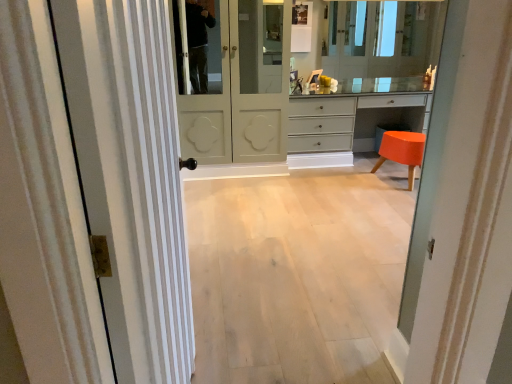
Question: Is clear glass mirror at upper center located outside light wood floor at center?

Choices:
 (A) yes
 (B) no

Answer: (A)

Question: From a real-world perspective, is clear glass mirror at upper center on light wood floor at center?

Choices:
 (A) no
 (B) yes

Answer: (B)

Question: Is light wood floor at center located within clear glass mirror at upper center?

Choices:
 (A) yes
 (B) no

Answer: (B)

Question: Is clear glass mirror at upper center at the left side of light wood floor at center?

Choices:
 (A) no
 (B) yes

Answer: (A)

Question: Does clear glass mirror at upper center have a greater height compared to light wood floor at center?

Choices:
 (A) no
 (B) yes

Answer: (B)

Question: Is clear glass mirror at upper center wider than light wood floor at center?

Choices:
 (A) yes
 (B) no

Answer: (B)

Question: Considering the relative sizes of matte gray chest of drawers at center and white striped door at left, the 1th door in the front-to-back sequence, in the image provided, is matte gray chest of drawers at center thinner than white striped door at left, the 1th door in the front-to-back sequence,?

Choices:
 (A) no
 (B) yes

Answer: (A)

Question: From a real-world perspective, is matte gray chest of drawers at center under white striped door at left, the 1th door in the front-to-back sequence?

Choices:
 (A) yes
 (B) no

Answer: (A)

Question: Is matte gray chest of drawers at center in front of white striped door at left, arranged as the 1th door when viewed from the left?

Choices:
 (A) no
 (B) yes

Answer: (A)

Question: Are matte gray chest of drawers at center and white striped door at left, which is the second door from back to front, making contact?

Choices:
 (A) yes
 (B) no

Answer: (B)

Question: Does matte gray chest of drawers at center appear on the right side of white striped door at left, acting as the 2th door starting from the right?

Choices:
 (A) no
 (B) yes

Answer: (B)

Question: Could you tell me if matte gray chest of drawers at center is turned towards white striped door at left, arranged as the 1th door when viewed from the left?

Choices:
 (A) yes
 (B) no

Answer: (A)

Question: Is the depth of matte gray chest of drawers at center greater than that of matte white door at center, which is the second door from front to back?

Choices:
 (A) no
 (B) yes

Answer: (B)